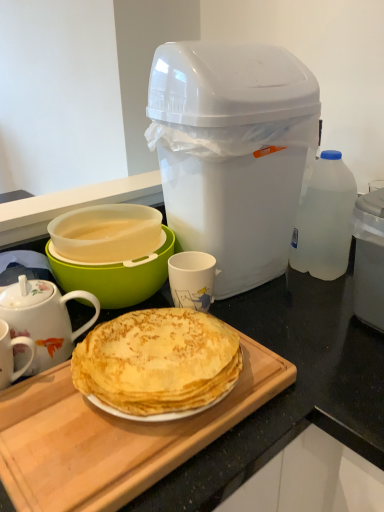
What do you see at coordinates (232, 152) in the screenshot?
I see `white plastic trash can at upper right` at bounding box center [232, 152].

Where is `white plastic trash can at upper right`? The image size is (384, 512). white plastic trash can at upper right is located at coordinates (232, 152).

This screenshot has width=384, height=512. What do you see at coordinates (192, 279) in the screenshot?
I see `white matte mug at center` at bounding box center [192, 279].

Find the location of a particular element. translucent plastic bowl at center left is located at coordinates (116, 275).

What do you see at coordinates (43, 319) in the screenshot? This screenshot has height=512, width=384. I see `porcelain floral teapot at left` at bounding box center [43, 319].

What are the coordinates of `white plastic trash can at upper right` in the screenshot? It's located at click(232, 152).

Between transparent plastic bottle at right and white matte mug at center, which one is positioned behind?

transparent plastic bottle at right is more distant.

Looking at this image, are transparent plastic bottle at right and white matte mug at center far apart?

transparent plastic bottle at right is near white matte mug at center, not far away.

Would you say transparent plastic bottle at right is to the left or to the right of white matte mug at center in the picture?

transparent plastic bottle at right is to the right of white matte mug at center.

From the image's perspective, is transparent plastic bottle at right on top of white matte mug at center?

Yes.

Identify the location of trash bin/can above the translucent plastic bowl at center left (from a real-world perspective). The image size is (384, 512). (232, 152).

From a real-world perspective, is translucent plastic bowl at center left located beneath white plastic trash can at upper right?

Yes, from a real-world perspective, translucent plastic bowl at center left is beneath white plastic trash can at upper right.

Which of these two, translucent plastic bowl at center left or white plastic trash can at upper right, is wider?

With larger width is white plastic trash can at upper right.

Considering the points (128, 262) and (172, 59), which point is in front, point (128, 262) or point (172, 59)?

Positioned in front is point (172, 59).

From the image's perspective, which object appears higher, translucent plastic bowl at center left or porcelain floral teapot at left?

translucent plastic bowl at center left, from the image's perspective.

From a real-world perspective, is translucent plastic bowl at center left positioned above or below porcelain floral teapot at left?

Clearly, from a real-world perspective, translucent plastic bowl at center left is above porcelain floral teapot at left.

Does translucent plastic bowl at center left have a lesser height compared to porcelain floral teapot at left?

→ Correct, translucent plastic bowl at center left is not as tall as porcelain floral teapot at left.

Are translucent plastic bowl at center left and porcelain floral teapot at left far apart?

Actually, translucent plastic bowl at center left and porcelain floral teapot at left are a little close together.

Would you consider white plastic trash can at upper right to be distant from porcelain floral teapot at left?

No, there isn't a large distance between white plastic trash can at upper right and porcelain floral teapot at left.

Is white plastic trash can at upper right oriented away from porcelain floral teapot at left?

That's not correct — white plastic trash can at upper right is not looking away from porcelain floral teapot at left.

How far apart are white plastic trash can at upper right and porcelain floral teapot at left?

white plastic trash can at upper right and porcelain floral teapot at left are 14.32 inches apart from each other.

Which is closer, [323,186] or [213,197]?

Point [323,186] is farther from the camera than point [213,197].

Is transparent plastic bottle at right smaller than white plastic trash can at upper right?

Correct, transparent plastic bottle at right occupies less space than white plastic trash can at upper right.

Which object is closer to the camera, transparent plastic bottle at right or white plastic trash can at upper right?

white plastic trash can at upper right.

Is transparent plastic bottle at right taller or shorter than white plastic trash can at upper right?

In the image, transparent plastic bottle at right appears to be shorter than white plastic trash can at upper right.

Considering the sizes of objects white matte mug at center and transparent plastic bottle at right in the image provided, who is wider, white matte mug at center or transparent plastic bottle at right?

Wider between the two is transparent plastic bottle at right.

Is white matte mug at center outside of transparent plastic bottle at right?

Yes, white matte mug at center is outside of transparent plastic bottle at right.

From the image's perspective, is white matte mug at center under transparent plastic bottle at right?

Correct, white matte mug at center appears lower than transparent plastic bottle at right in the image.

Is white matte mug at center next to transparent plastic bottle at right?

white matte mug at center is not next to transparent plastic bottle at right, and they're not touching.

From the image's perspective, does wooden cutting board at center appear higher than translucent plastic bowl at center left?

No, from the image's perspective, wooden cutting board at center is not above translucent plastic bowl at center left.

Considering the relative sizes of wooden cutting board at center and translucent plastic bowl at center left in the image provided, is wooden cutting board at center thinner than translucent plastic bowl at center left?

Incorrect, the width of wooden cutting board at center is not less than that of translucent plastic bowl at center left.

Is wooden cutting board at center smaller than translucent plastic bowl at center left?

Correct, wooden cutting board at center occupies less space than translucent plastic bowl at center left.

Is wooden cutting board at center not near translucent plastic bowl at center left?

No, wooden cutting board at center is in close proximity to translucent plastic bowl at center left.

Identify the location of coffee cup below the transparent plastic bottle at right (from a real-world perspective). The height and width of the screenshot is (512, 384). (192, 279).

Locate an element on the screen. trash bin/can above the translucent plastic bowl at center left (from the image's perspective) is located at coordinates (232, 152).

From the image, which object appears to be farther from translucent plastic bowl at center left, transparent plastic bottle at right or white plastic trash can at upper right?

The object further to translucent plastic bowl at center left is transparent plastic bottle at right.

Looking at the image, which one is located further to translucent plastic bowl at center left, wooden cutting board at center or white matte mug at center?

wooden cutting board at center.

From the picture: Considering their positions, is white matte mug at center positioned closer to translucent plastic bowl at center left than porcelain floral teapot at left?

Among the two, porcelain floral teapot at left is located nearer to translucent plastic bowl at center left.

Looking at the image, which one is located closer to porcelain floral teapot at left, transparent plastic bottle at right or translucent plastic bowl at center left?

Among the two, translucent plastic bowl at center left is located nearer to porcelain floral teapot at left.

When comparing their distances from wooden cutting board at center, does white plastic trash can at upper right or transparent plastic bottle at right seem closer?

Based on the image, white plastic trash can at upper right appears to be nearer to wooden cutting board at center.

Which object lies further to the anchor point white plastic trash can at upper right, translucent plastic bowl at center left or wooden cutting board at center?

wooden cutting board at center.

When comparing their distances from transparent plastic bottle at right, does white plastic trash can at upper right or wooden cutting board at center seem further?

wooden cutting board at center.

From the image, which object appears to be farther from transparent plastic bottle at right, white matte mug at center or wooden cutting board at center?

Among the two, wooden cutting board at center is located further to transparent plastic bottle at right.

You are a GUI agent. You are given a task and a screenshot of the screen. Output one action in this format:
    pyautogui.click(x=<x>, y=<y>)
    Task: Click on the trash bin/can between porcelain floral teapot at left and transparent plastic bottle at right from left to right
    Image resolution: width=384 pixels, height=512 pixels.
    Given the screenshot: What is the action you would take?
    pos(232,152)

The width and height of the screenshot is (384, 512). Find the location of `teapot between wooden cutting board at center and white matte mug at center along the z-axis`. teapot between wooden cutting board at center and white matte mug at center along the z-axis is located at coordinates (43, 319).

Locate an element on the screen. The width and height of the screenshot is (384, 512). cutting board situated between porcelain floral teapot at left and transparent plastic bottle at right from left to right is located at coordinates (112, 437).

Locate an element on the screen. This screenshot has height=512, width=384. bowl situated between porcelain floral teapot at left and transparent plastic bottle at right from left to right is located at coordinates (116, 275).